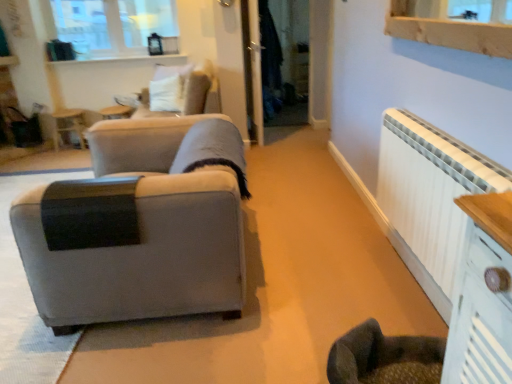
Question: In the image, is wooden side table at upper left positioned in front of or behind clear glass window at upper left?

Choices:
 (A) front
 (B) behind

Answer: (B)

Question: From the image's perspective, is wooden side table at upper left located above or below clear glass window at upper left?

Choices:
 (A) above
 (B) below

Answer: (B)

Question: Which is farther from the white painted radiator at right?

Choices:
 (A) wooden side table at upper left
 (B) velvet beige swivel chair at upper center
 (C) transparent glass door at center
 (D) clear glass window at upper left
 (E) white glossy ledge at upper center

Answer: (A)

Question: Which of these objects is positioned closest to the velvet beige swivel chair at upper center?

Choices:
 (A) transparent glass door at center
 (B) wooden side table at upper left
 (C) white glossy ledge at upper center
 (D) matte gray fabric couch at left
 (E) white painted radiator at right

Answer: (C)